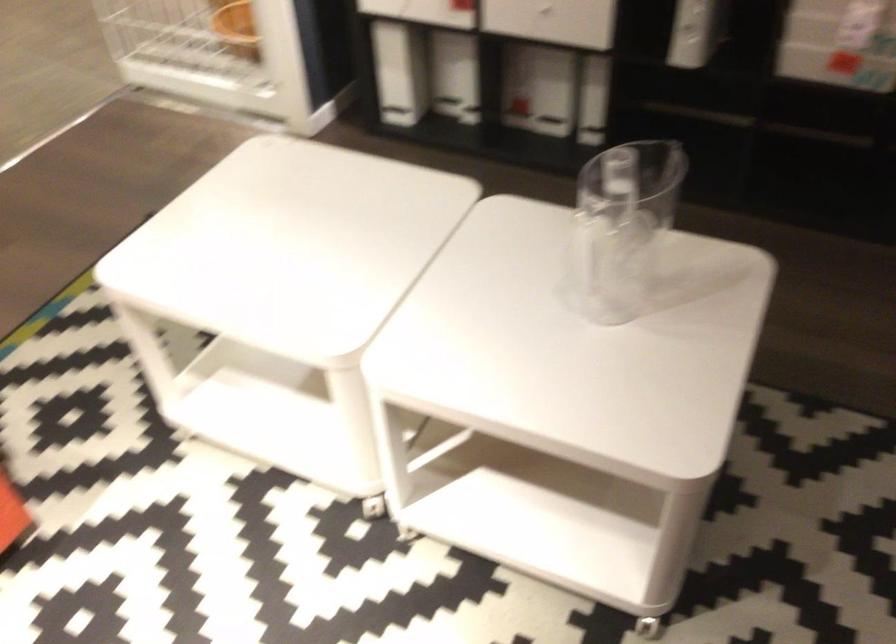
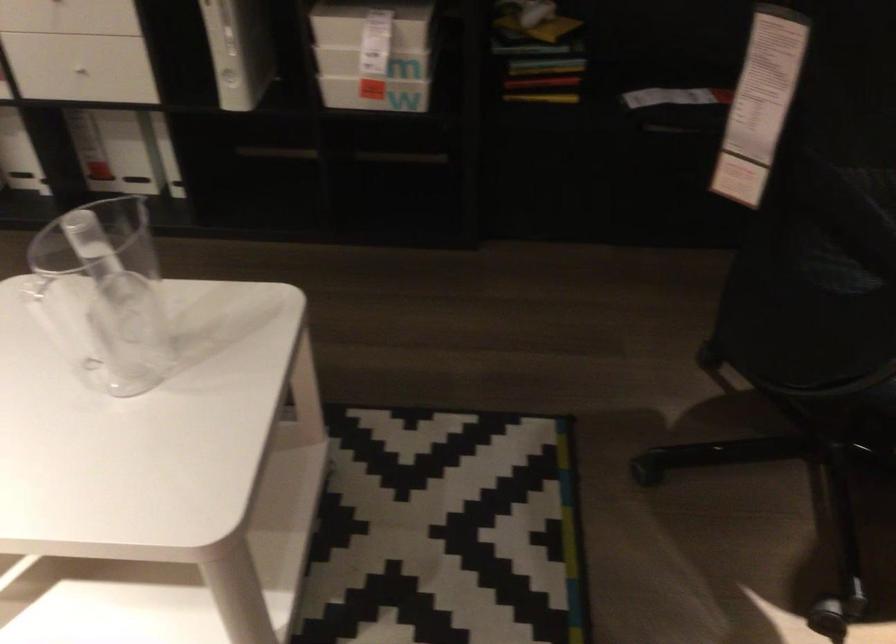
Question: The first image is from the beginning of the video and the second image is from the end. How did the camera likely rotate when shooting the video?

Choices:
 (A) Left
 (B) Right
 (C) Up
 (D) Down

Answer: (B)